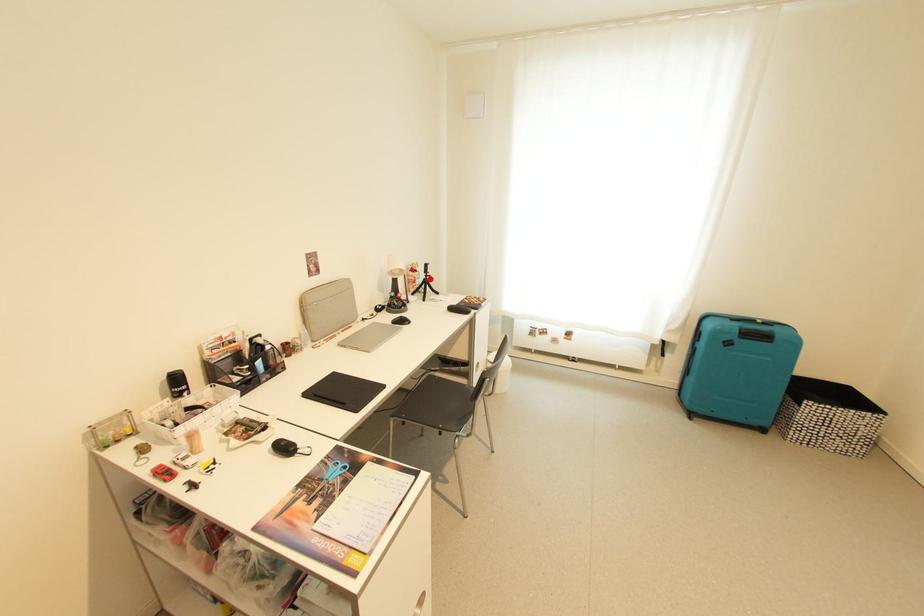
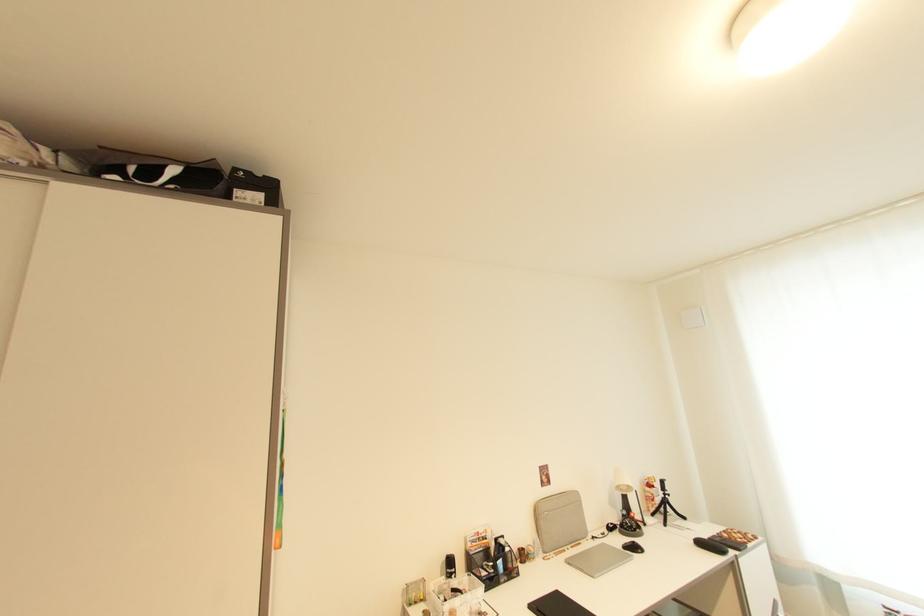
Find the pixel in the second image that matches the highlighted location in the first image.

(669, 498)